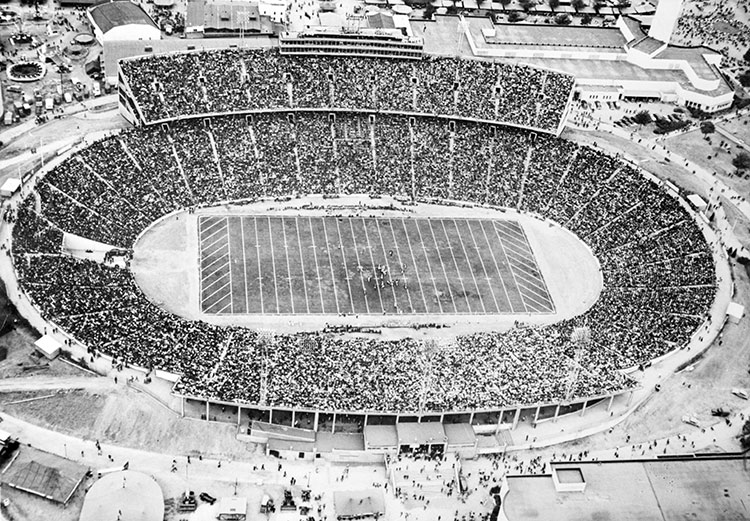
I want to click on entrance, so click(x=417, y=450).